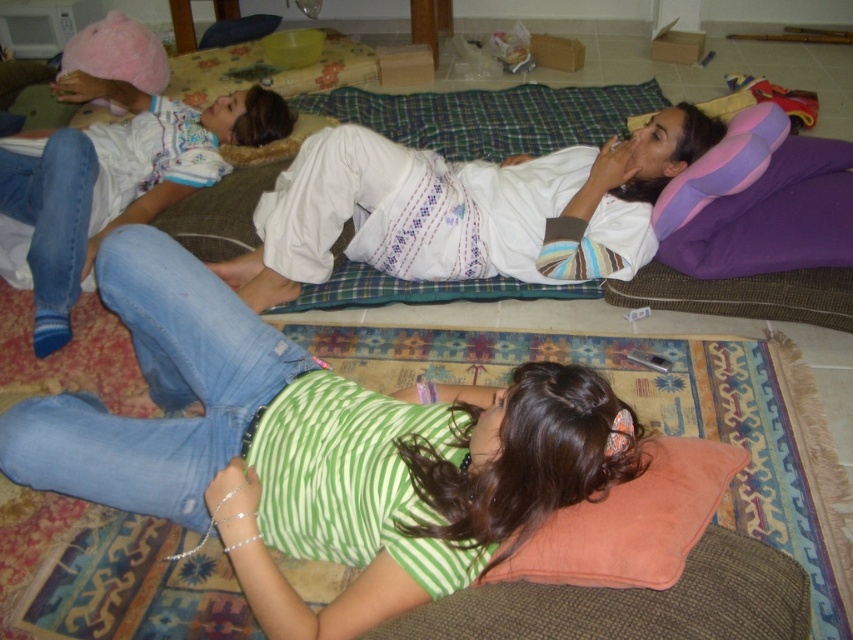
You are trying to place a small plant between the pink fuzzy hat at upper left and the orange velvety pillow at lower center. According to the spatial arrangement, where should you place it?

The pink fuzzy hat at upper left is positioned over orange velvety pillow at lower center, so placing the small plant between them would require placing it below the pink fuzzy hat at upper left and above the orange velvety pillow at lower center.

You are organizing a small indoor picnic and need to place a decorative pillow and a hat on the table. The table is only 1 meter tall. Given the height of the pink fuzzy hat at upper left and the orange velvety pillow at lower center, which item would you choose to place on the table to ensure it doesn

The orange velvety pillow at lower center should be placed on the table since it is shorter than the pink fuzzy hat at upper left, ensuring it fits within the table